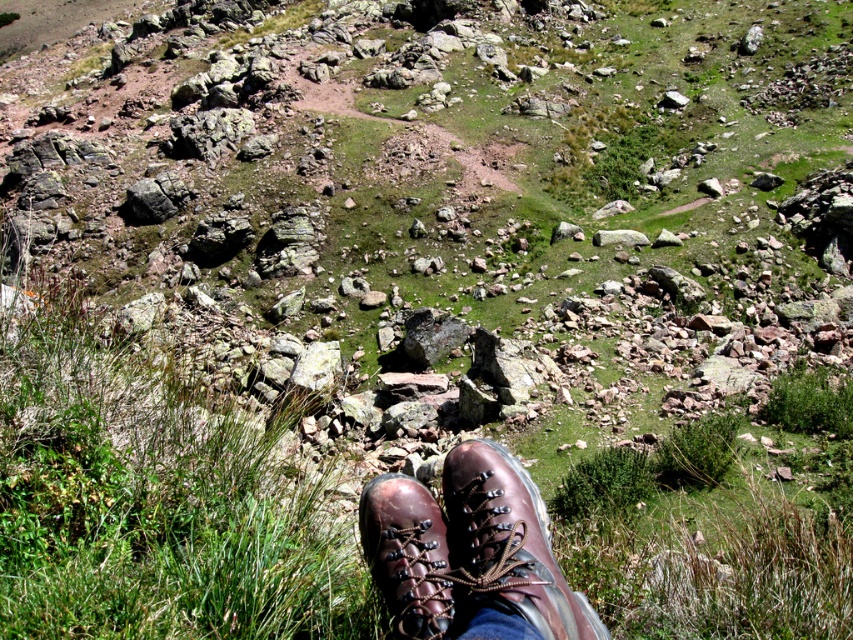
You are a hiker planning to place a lightweight backpack on the ground near the shiny brown leather boot at lower center. Given the coordinates from the image, where exactly should you place the backpack to ensure it stays close to the boot without overlapping?

The shiny brown leather boot at lower center is located at point (x=508, y=541). To place the backpack close without overlapping, position it near these coordinates but slightly offset, such as at (x=511, y=544) to maintain proximity while avoiding overlap.

You are a photographer trying to capture the rugged outdoor scene. You notice two points in the image at coordinates point (473,496) and point (415,483). Which point is nearer to your camera lens?

Point (473,496) is closer to the camera than point (415,483).